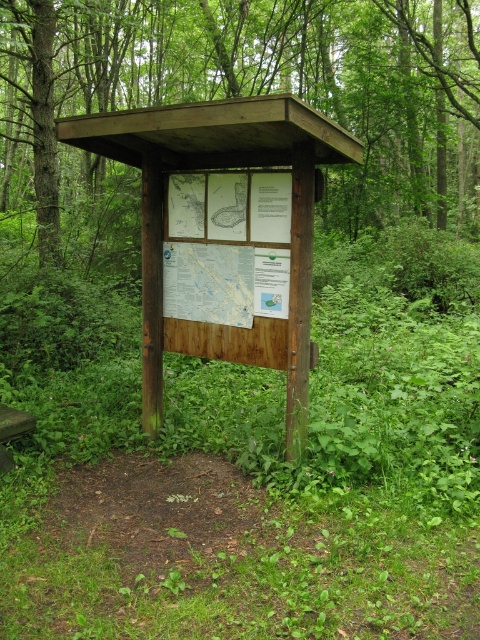
Is brown wood sign at center to the right of wooden signboard at center from the viewer's perspective?

No, brown wood sign at center is not to the right of wooden signboard at center.

Does point (471, 29) come closer to viewer compared to point (81, 144)?

No, (471, 29) is further to viewer.

Find the location of a particular element. The width and height of the screenshot is (480, 640). brown wood sign at center is located at coordinates (252, 92).